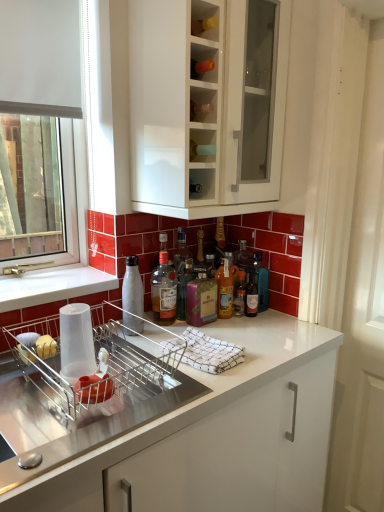
The height and width of the screenshot is (512, 384). What are the coordinates of `metallic silver dish washer at lower center` in the screenshot? It's located at (101, 386).

Locate an element on the screen. The height and width of the screenshot is (512, 384). translucent glass bottle at center, arranged as the second bottle when viewed from the right is located at coordinates [x=251, y=295].

I want to click on white textured screen door at right, so tap(363, 318).

Is the depth of metallic silver dish washer at lower center less than that of translucent glass bottle at center, acting as the 5th bottle starting from the right?

Yes, the depth of metallic silver dish washer at lower center is less than that of translucent glass bottle at center, acting as the 5th bottle starting from the right.

Is metallic silver dish washer at lower center completely or partially outside of translucent glass bottle at center, acting as the 5th bottle starting from the right?

Indeed, metallic silver dish washer at lower center is completely outside translucent glass bottle at center, acting as the 5th bottle starting from the right.

Is translucent glass bottle at center, the second bottle from the left, at the back of metallic silver dish washer at lower center?

metallic silver dish washer at lower center is not turned away from translucent glass bottle at center, the second bottle from the left.

Which is closer to the camera, (97,388) or (154,290)?

The point (97,388) is closer to the camera.

Considering the positions of objects purple glass bottle at center, placed as the 4th bottle when sorted from right to left, and translucent glass bottle at center, arranged as the second bottle when viewed from the right, in the image provided, who is in front, purple glass bottle at center, placed as the 4th bottle when sorted from right to left, or translucent glass bottle at center, arranged as the second bottle when viewed from the right,?

purple glass bottle at center, placed as the 4th bottle when sorted from right to left, is in front.

Considering the positions of points (211, 301) and (250, 302), is point (211, 301) farther from camera compared to point (250, 302)?

No, it is in front of (250, 302).

Who is taller, purple glass bottle at center, placed as the 4th bottle when sorted from right to left, or translucent glass bottle at center, marked as the fifth bottle in a left-to-right arrangement?

Standing taller between the two is purple glass bottle at center, placed as the 4th bottle when sorted from right to left.

From a real-world perspective, is purple glass bottle at center, the 3th bottle from the left, positioned under translucent glass bottle at center, marked as the fifth bottle in a left-to-right arrangement, based on gravity?

No, from a real-world perspective, purple glass bottle at center, the 3th bottle from the left, is not under translucent glass bottle at center, marked as the fifth bottle in a left-to-right arrangement.

Is the position of translucent glass bottle at center, marked as the fifth bottle in a left-to-right arrangement, less distant than that of white textured screen door at right?

No, the depth of translucent glass bottle at center, marked as the fifth bottle in a left-to-right arrangement, is greater than that of white textured screen door at right.

Considering the positions of points (250, 271) and (362, 123), is point (250, 271) closer to camera compared to point (362, 123)?

No, it is not.

From the picture: Considering the sizes of objects translucent glass bottle at center, marked as the fifth bottle in a left-to-right arrangement, and white textured screen door at right in the image provided, who is smaller, translucent glass bottle at center, marked as the fifth bottle in a left-to-right arrangement, or white textured screen door at right?

translucent glass bottle at center, marked as the fifth bottle in a left-to-right arrangement.

At what (x,y) coordinates should I click in order to perform the action: click on screen door below the translucent glass bottle at center, acting as the 5th bottle starting from the right (from a real-world perspective). Please return your answer as a coordinate pair (x, y). The image size is (384, 512). Looking at the image, I should click on (363, 318).

Which of these two, translucent glass bottle at center, the second bottle from the left, or white textured screen door at right, stands taller?

white textured screen door at right.

Is translucent glass bottle at center, acting as the 5th bottle starting from the right, positioned in front of white textured screen door at right?

No, translucent glass bottle at center, acting as the 5th bottle starting from the right, is further to the viewer.

Is transparent plastic cup at sink at the left side of purple glass bottle at center, placed as the 4th bottle when sorted from right to left?

Indeed, transparent plastic cup at sink is positioned on the left side of purple glass bottle at center, placed as the 4th bottle when sorted from right to left.

Does point (81, 314) appear closer or farther from the camera than point (195, 280)?

Clearly, point (81, 314) is closer to the camera than point (195, 280).

How many degrees apart are the facing directions of transparent plastic cup at sink and purple glass bottle at center, placed as the 4th bottle when sorted from right to left?

transparent plastic cup at sink and purple glass bottle at center, placed as the 4th bottle when sorted from right to left, are facing 0.832 degrees away from each other.

From a real-world perspective, is transparent plastic cup at sink positioned over purple glass bottle at center, the 3th bottle from the left, based on gravity?

No, from a real-world perspective, transparent plastic cup at sink is not above purple glass bottle at center, the 3th bottle from the left.

From a real-world perspective, is translucent glass bottle at center, the third bottle in the right-to-left sequence, on top of white glossy cabinet at upper center?

No, from a real-world perspective, translucent glass bottle at center, the third bottle in the right-to-left sequence, is not over white glossy cabinet at upper center

You are a GUI agent. You are given a task and a screenshot of the screen. Output one action in this format:
    pyautogui.click(x=<x>, y=<y>)
    Task: Click on the 4th bottle behind when counting from the white glossy cabinet at upper center
    Image resolution: width=384 pixels, height=512 pixels.
    Given the screenshot: What is the action you would take?
    pyautogui.click(x=225, y=288)

From the image's perspective, between translucent glass bottle at center, the third bottle in the right-to-left sequence, and white glossy cabinet at upper center, who is located below?

translucent glass bottle at center, the third bottle in the right-to-left sequence, is shown below in the image.

Is there a large distance between transparent plastic cup at sink and white matte bottle at sink, the sixth bottle from the right?

Answer: No, transparent plastic cup at sink is not far away from white matte bottle at sink, the sixth bottle from the right.

What's the angular difference between transparent plastic cup at sink and white matte bottle at sink, placed as the 1th bottle when sorted from left to right,'s facing directions?

The facing directions of transparent plastic cup at sink and white matte bottle at sink, placed as the 1th bottle when sorted from left to right, are 0.835 degrees apart.

From the image's perspective, who appears lower, transparent plastic cup at sink or white matte bottle at sink, placed as the 1th bottle when sorted from left to right?

transparent plastic cup at sink.

Is transparent plastic cup at sink turned away from white matte bottle at sink, placed as the 1th bottle when sorted from left to right?

transparent plastic cup at sink is not turned away from white matte bottle at sink, placed as the 1th bottle when sorted from left to right.

Find the location of a particular element. The image size is (384, 512). dish washer below the translucent glass bottle at center, the second bottle from the left (from the image's perspective) is located at coordinates (101, 386).

Where is `the 2nd bottle to the right of the purple glass bottle at center, the 3th bottle from the left, counting from the anchor's position`? This screenshot has height=512, width=384. the 2nd bottle to the right of the purple glass bottle at center, the 3th bottle from the left, counting from the anchor's position is located at coordinates (251, 295).

Based on their spatial positions, is translucent glass bottle at center, arranged as the second bottle when viewed from the right, or purple glass bottle at center, placed as the 4th bottle when sorted from right to left, further from white matte bottle at sink, placed as the 1th bottle when sorted from left to right?

translucent glass bottle at center, arranged as the second bottle when viewed from the right, is further to white matte bottle at sink, placed as the 1th bottle when sorted from left to right.

Considering their positions, is purple glass bottle at center, the 3th bottle from the left, positioned further to translucent glass bottle at center, placed as the first bottle when sorted from right to left, than white matte bottle at sink, the sixth bottle from the right?

Among the two, white matte bottle at sink, the sixth bottle from the right, is located further to translucent glass bottle at center, placed as the first bottle when sorted from right to left.

Looking at the image, which one is located closer to translucent glass bottle at center, the fourth bottle in the left-to-right sequence, metallic silver dish washer at lower center or white textured screen door at right?

Based on the image, metallic silver dish washer at lower center appears to be nearer to translucent glass bottle at center, the fourth bottle in the left-to-right sequence.

Estimate the real-world distances between objects in this image. Which object is closer to metallic silver dish washer at lower center, white matte bottle at sink, the sixth bottle from the right, or translucent glass bottle at center, the second bottle from the left?

white matte bottle at sink, the sixth bottle from the right, is positioned closer to the anchor metallic silver dish washer at lower center.

From the image, which object appears to be farther from translucent glass bottle at center, the third bottle in the right-to-left sequence, metallic silver dish washer at lower center or translucent glass bottle at center, marked as the fifth bottle in a left-to-right arrangement?

The object further to translucent glass bottle at center, the third bottle in the right-to-left sequence, is metallic silver dish washer at lower center.

Which object lies further to the anchor point white matte bottle at sink, the sixth bottle from the right, purple glass bottle at center, the 3th bottle from the left, or transparent plastic cup at sink?

Based on the image, transparent plastic cup at sink appears to be further to white matte bottle at sink, the sixth bottle from the right.

When comparing their distances from white textured screen door at right, does translucent glass bottle at center, arranged as the second bottle when viewed from the right, or translucent glass bottle at center, marked as the 6th bottle in a left-to-right arrangement, seem closer?

translucent glass bottle at center, marked as the 6th bottle in a left-to-right arrangement, lies closer to white textured screen door at right than the other object.

Looking at the image, which one is located further to white textured screen door at right, translucent glass bottle at center, the second bottle from the left, or purple glass bottle at center, the 3th bottle from the left?

Based on the image, translucent glass bottle at center, the second bottle from the left, appears to be further to white textured screen door at right.

Image resolution: width=384 pixels, height=512 pixels. Identify the location of cabinetry situated between white matte bottle at sink, placed as the 1th bottle when sorted from left to right, and white textured screen door at right from left to right. (206, 104).

Identify the location of paper towel located between metallic silver dish washer at lower center and translucent glass bottle at center, the fourth bottle in the left-to-right sequence, in the depth direction. pos(76,342).

In order to click on paper towel located between metallic silver dish washer at lower center and translucent glass bottle at center, marked as the 6th bottle in a left-to-right arrangement, in the depth direction in this screenshot , I will do `click(76, 342)`.

At what (x,y) coordinates should I click in order to perform the action: click on bottle located between translucent glass bottle at center, the fourth bottle in the left-to-right sequence, and translucent glass bottle at center, placed as the first bottle when sorted from right to left, in the left-right direction. Please return your answer as a coordinate pair (x, y). The image size is (384, 512). Looking at the image, I should click on (251, 295).